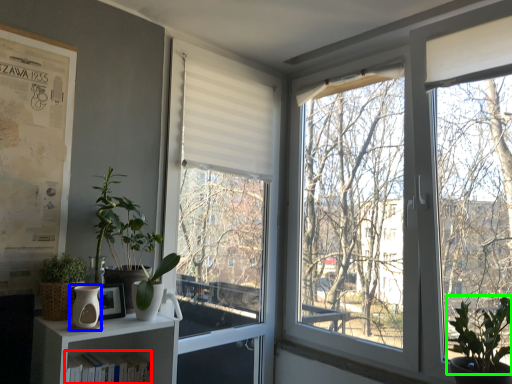
Question: Which is farther away from book (highlighted by a red box)? vase (highlighted by a blue box) or vegetation (highlighted by a green box)?

Choices:
 (A) vase
 (B) vegetation

Answer: (B)